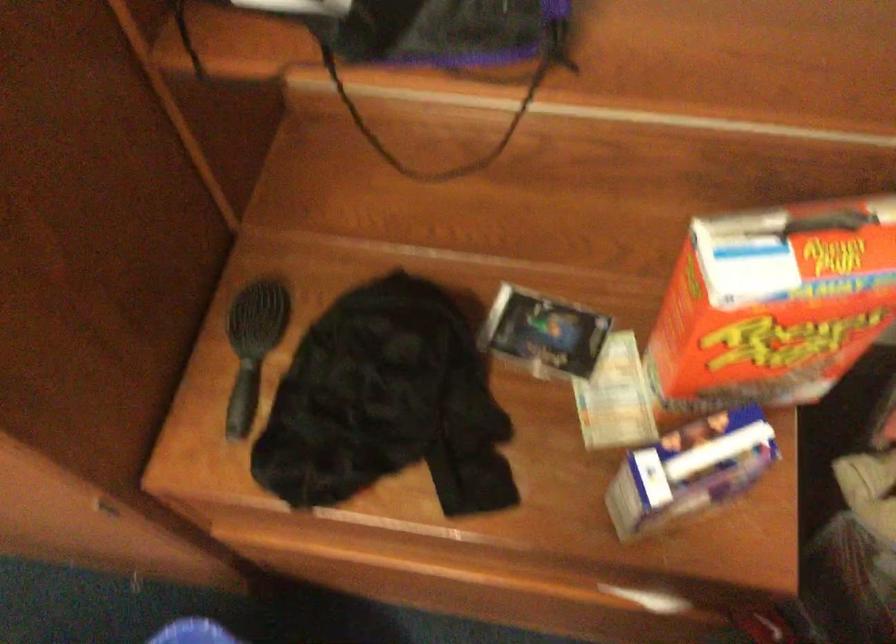
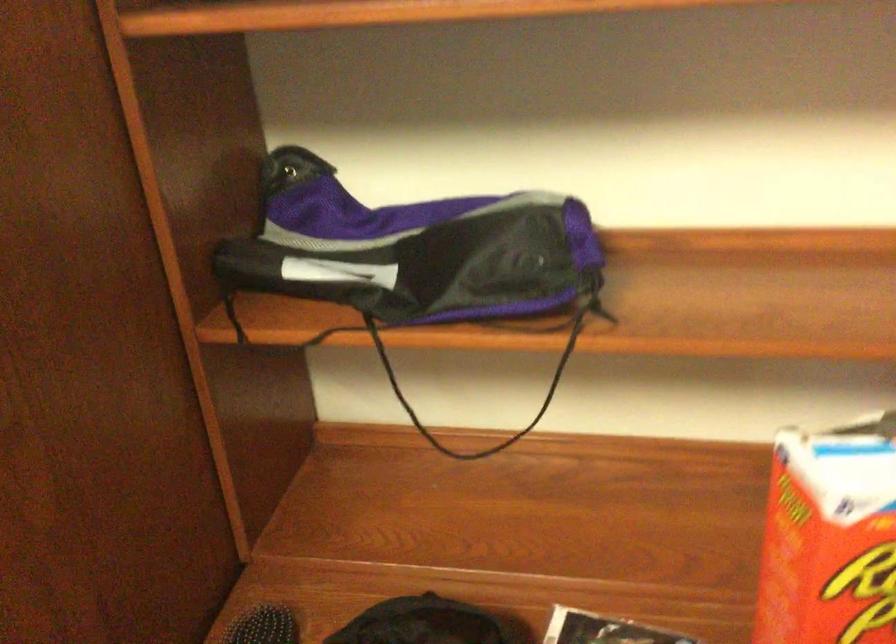
Question: The first image is from the beginning of the video and the second image is from the end. How did the camera likely rotate when shooting the video?

Choices:
 (A) Left
 (B) Right
 (C) Up
 (D) Down

Answer: (C)